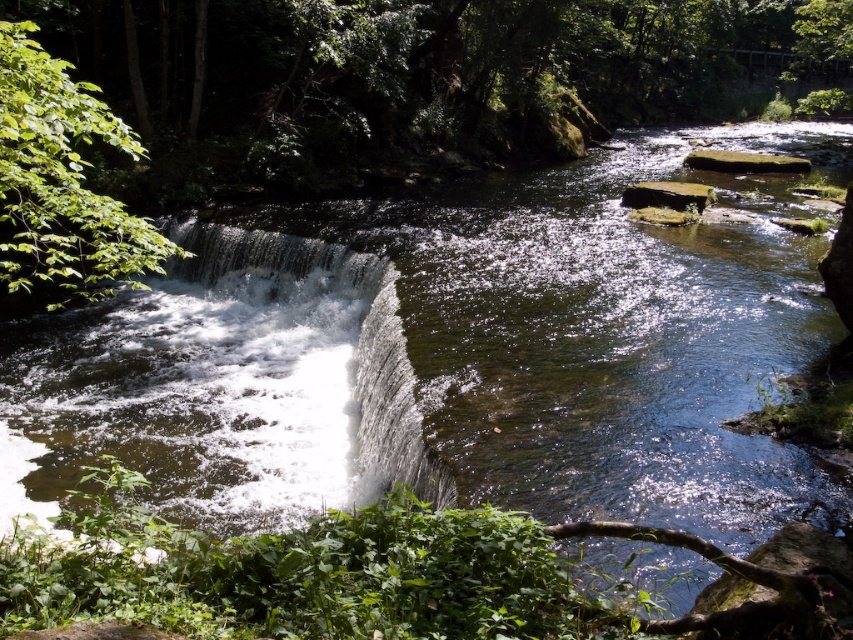
Which is in front, point (318, 476) or point (96, 269)?

Point (318, 476) is more forward.

Who is positioned more to the right, white frothy water at center or green leafy tree at left?

Positioned to the right is white frothy water at center.

Which is in front, point (225, 436) or point (33, 134)?

Point (33, 134) is more forward.

Locate an element on the screen. This screenshot has width=853, height=640. white frothy water at center is located at coordinates (223, 387).